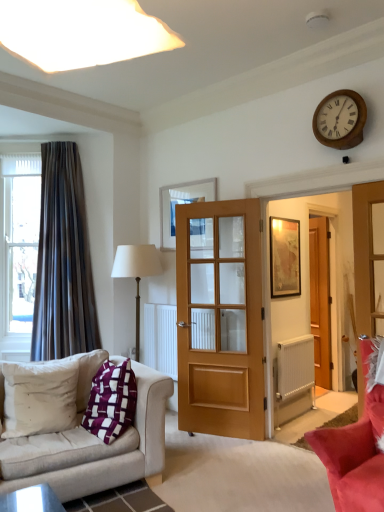
The width and height of the screenshot is (384, 512). In order to click on vacant space to the right of beige fabric couch at lower left, the 1th studio couch positioned from the left in this screenshot , I will do `click(218, 478)`.